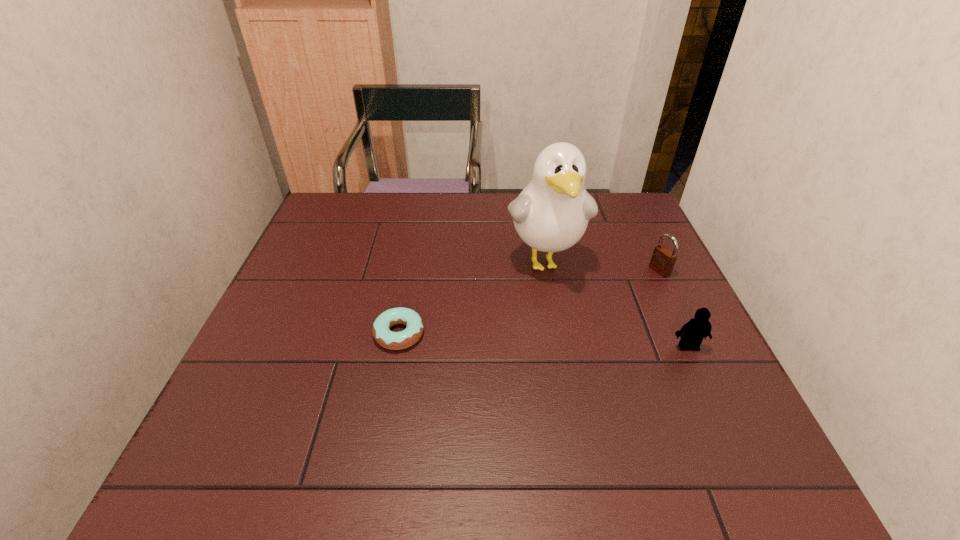
Where is `empty space between the tallest object and the padlock`? empty space between the tallest object and the padlock is located at coordinates (602, 266).

The width and height of the screenshot is (960, 540). Identify the location of vacant space that's between the doughnut and the padlock. (529, 302).

At what (x,y) coordinates should I click in order to perform the action: click on vacant space in between the Lego and the third object from right to left. Please return your answer as a coordinate pair (x, y). The width and height of the screenshot is (960, 540). Looking at the image, I should click on (616, 304).

Locate an element on the screen. vacant space in between the third object from right to left and the padlock is located at coordinates (602, 266).

Find the location of `object that is the third closest one to the padlock`. object that is the third closest one to the padlock is located at coordinates (381, 331).

Identify the location of object that is the third closest to the second object from left to right. Image resolution: width=960 pixels, height=540 pixels. (381, 331).

Image resolution: width=960 pixels, height=540 pixels. Find the location of `blank area in the image that satisfies the following two spatial constraints: 1. on the back side of the doughnut; 2. on the left side of the gull`. blank area in the image that satisfies the following two spatial constraints: 1. on the back side of the doughnut; 2. on the left side of the gull is located at coordinates (413, 261).